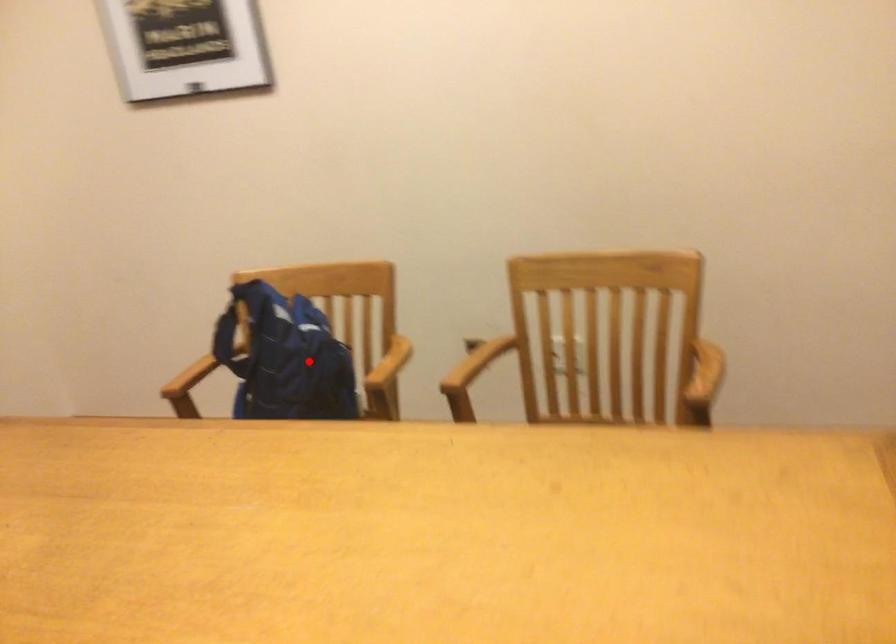
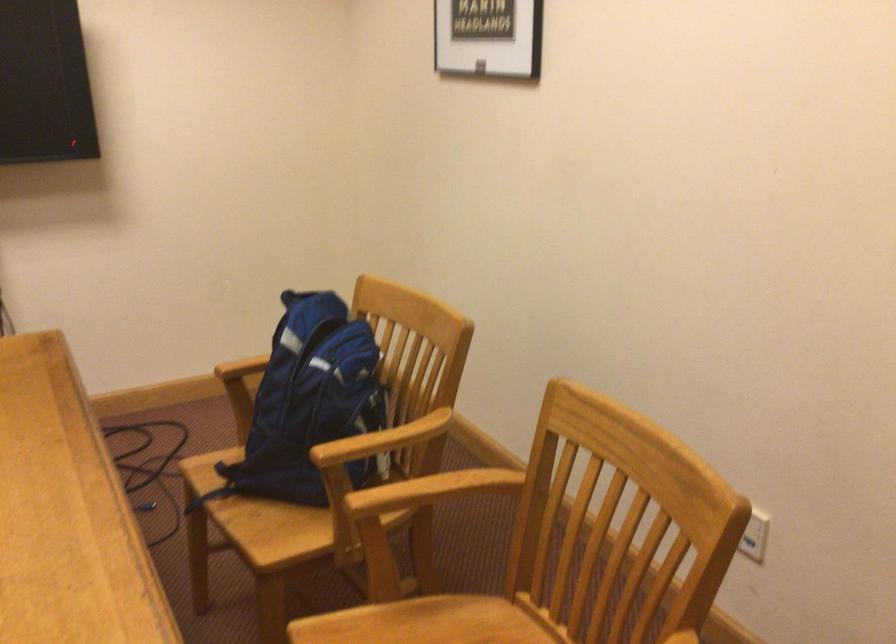
Question: I am providing you with two images of the same scene from different viewpoints. Given a red point in image1, look at the same physical point in image2. Is it:

Choices:
 (A) Closer to the viewpoint
 (B) Farther from the viewpoint

Answer: (A)